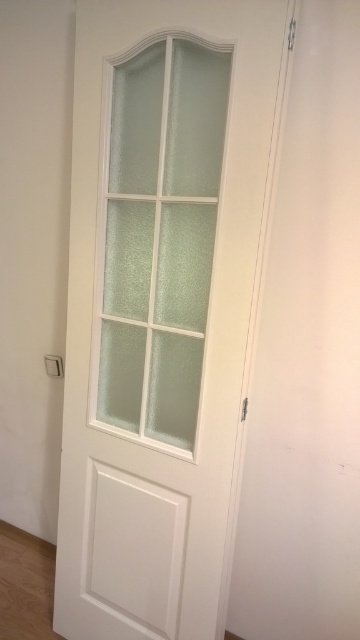
You are trying to decide which door to use to exit the room quickly. The white matte door at center and the frosted glass door at center are both in front of you. Which door is wider?

The white matte door at center might be wider than frosted glass door at center, so the white matte door at center could be the better choice for a quicker exit.

You are standing in front of the white interior door with a frosted glass panel. You notice two points marked on the door. The first point is at coordinate point (222, 115) and the second is at point (110, 221). Which of these points is closer to you when facing the door?

Point (222, 115) is in front of point (110, 221), so it is closer to you when facing the door.